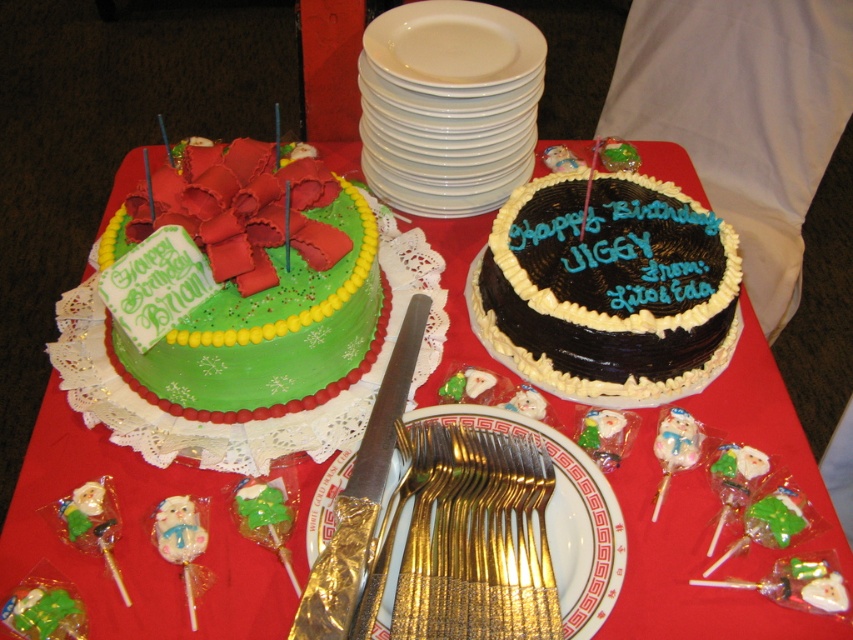
Question: Which point appears farthest from the camera in this image?

Choices:
 (A) (239, 280)
 (B) (479, 49)
 (C) (514, 339)
 (D) (503, 540)

Answer: (B)

Question: Is green fondant cake at upper left to the left of gold plated forks at center from the viewer's perspective?

Choices:
 (A) yes
 (B) no

Answer: (A)

Question: Which is nearer to the white glossy plate at upper center?

Choices:
 (A) white ceramic plate at upper center
 (B) chocolate frosted cake at center

Answer: (A)

Question: Is green fondant cake at upper left below white glossy plate at upper center?

Choices:
 (A) no
 (B) yes

Answer: (B)

Question: Is gold plated forks at center wider than white ceramic plate at upper center?

Choices:
 (A) no
 (B) yes

Answer: (A)

Question: Which of the following is the closest to the observer?

Choices:
 (A) chocolate frosted cake at center
 (B) gold plated forks at center

Answer: (B)